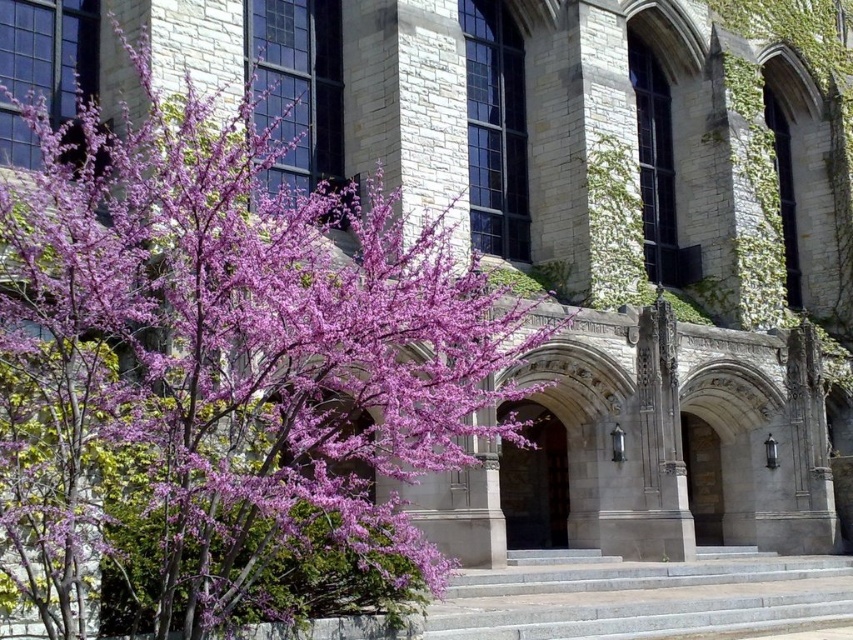
You are standing at the camera position and want to take a photo of the purple matte tree at left. Can you estimate how far you need to walk forward to get the tree to fill the frame without zooming?

The purple matte tree at left is 27.45 meters away from the camera. To fill the frame, you would need to move closer, but the exact distance depends on the camera sensor size and lens focal length. However, based on standard calculations, moving to about 10 meters away might work, but this is approximate.

You are a painter standing at the base of the gray stone stairs at center, intending to paint the purple matte tree at left. Considering your position, which object will appear taller in your painting?

The purple matte tree at left will appear taller in the painting because it has a greater height compared to the gray stone stairs at center.

You are standing in front of the historic stone building and want to take a photo of both the purple matte tree at left and the gray stone stairs at center. Based on their positions, which object should you position closer to the left side of your camera frame to include both in the shot?

The purple matte tree at left is to the left of the gray stone stairs at center, so you should position the purple matte tree at left closer to the left side of your camera frame to include both in the shot.